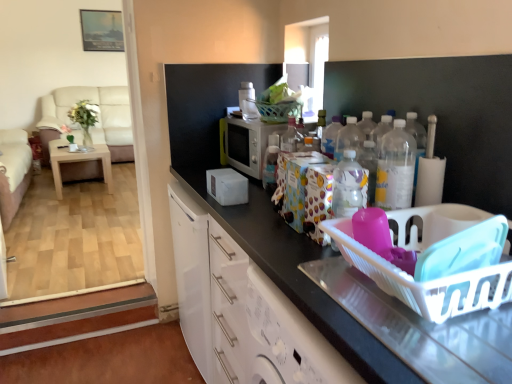
Question: Is clear plastic bottles at center-right at the right side of light brown wooden table at left?

Choices:
 (A) yes
 (B) no

Answer: (A)

Question: Does clear plastic bottles at center-right have a lesser height compared to light brown wooden table at left?

Choices:
 (A) yes
 (B) no

Answer: (A)

Question: Is clear plastic bottles at center-right closer to camera compared to light brown wooden table at left?

Choices:
 (A) yes
 (B) no

Answer: (A)

Question: From the image's perspective, would you say clear plastic bottles at center-right is shown under light brown wooden table at left?

Choices:
 (A) yes
 (B) no

Answer: (A)

Question: From a real-world perspective, is clear plastic bottles at center-right positioned under light brown wooden table at left based on gravity?

Choices:
 (A) yes
 (B) no

Answer: (B)

Question: Does point (259, 112) appear closer or farther from the camera than point (388, 205)?

Choices:
 (A) farther
 (B) closer

Answer: (A)

Question: Considering the positions of white glossy microwave at center, the 1th appliance from the top, and clear plastic bottles at center-right in the image, is white glossy microwave at center, the 1th appliance from the top, taller or shorter than clear plastic bottles at center-right?

Choices:
 (A) tall
 (B) short

Answer: (B)

Question: Based on their positions, is white glossy microwave at center, the second appliance when ordered from bottom to top, located to the left or right of clear plastic bottles at center-right?

Choices:
 (A) right
 (B) left

Answer: (B)

Question: Is white glossy microwave at center, the second appliance when ordered from bottom to top, spatially inside clear plastic bottles at center-right, or outside of it?

Choices:
 (A) inside
 (B) outside

Answer: (B)

Question: Is white plastic basket at right to the left or to the right of transparent glass screen door at upper center in the image?

Choices:
 (A) left
 (B) right

Answer: (B)

Question: Choose the correct answer: Is white plastic basket at right inside transparent glass screen door at upper center or outside it?

Choices:
 (A) outside
 (B) inside

Answer: (A)

Question: From the image's perspective, is white plastic basket at right located above or below transparent glass screen door at upper center?

Choices:
 (A) below
 (B) above

Answer: (A)

Question: Considering the positions of white plastic basket at right and transparent glass screen door at upper center in the image, is white plastic basket at right wider or thinner than transparent glass screen door at upper center?

Choices:
 (A) thin
 (B) wide

Answer: (B)

Question: Choose the correct answer: Is beige fabric couch at left, which is the second couch in back-to-front order, inside beige fabric couch at left, arranged as the first couch when viewed from the back, or outside it?

Choices:
 (A) outside
 (B) inside

Answer: (A)

Question: From a real-world perspective, is beige fabric couch at left, arranged as the first couch when viewed from the front, physically located above or below beige fabric couch at left, the second couch positioned from the front?

Choices:
 (A) below
 (B) above

Answer: (A)